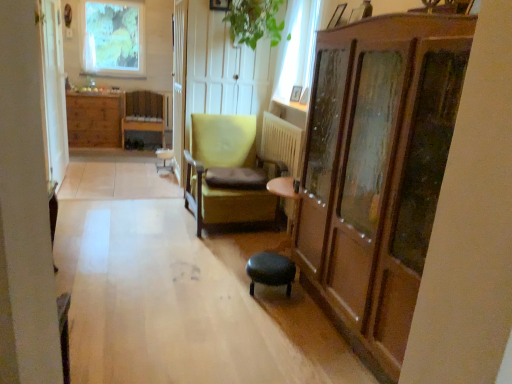
Where is `vacant area to the left of white wooden screen door at center, acting as the second screen door starting from the left`? vacant area to the left of white wooden screen door at center, acting as the second screen door starting from the left is located at coordinates (142, 179).